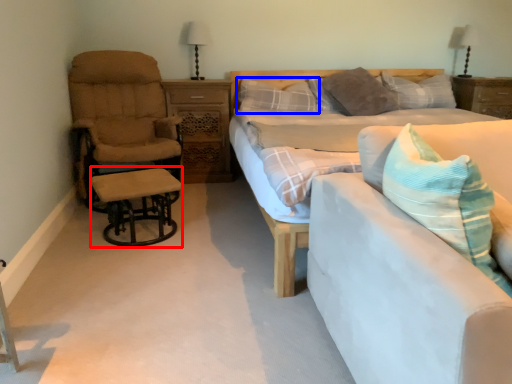
Question: Among these objects, which one is nearest to the camera, table (highlighted by a red box) or pillow (highlighted by a blue box)?

Choices:
 (A) table
 (B) pillow

Answer: (A)